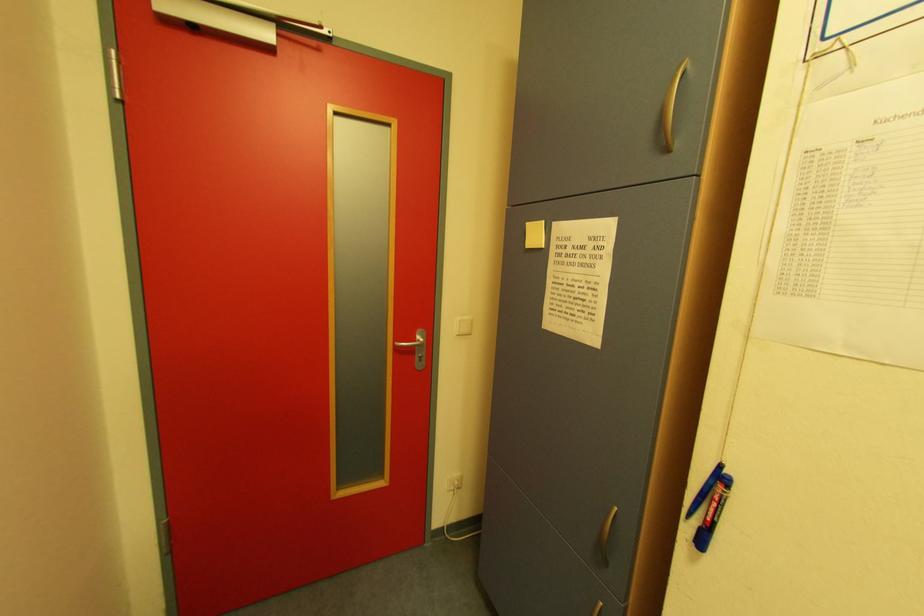
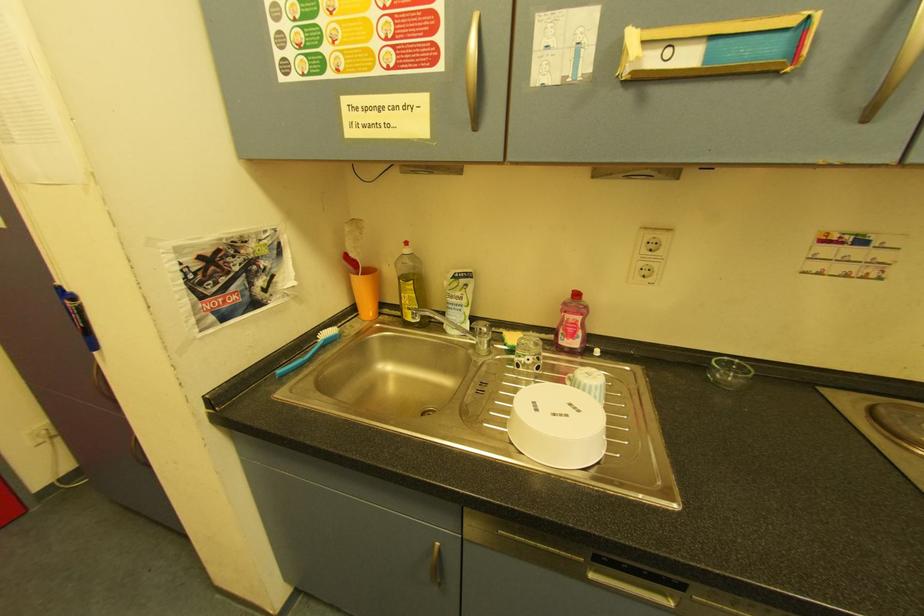
The first image is from the beginning of the video and the second image is from the end. How did the camera likely rotate when shooting the video?

The rotation direction of the camera is right-down.